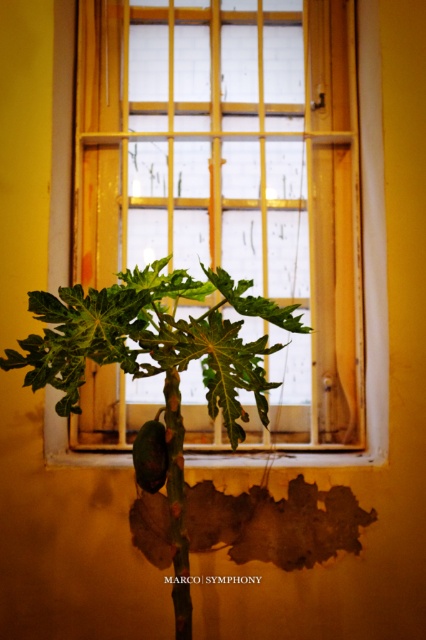
Can you confirm if green matte leafy plant at center is positioned to the right of wooden frame at center?

No, green matte leafy plant at center is not to the right of wooden frame at center.

Is green matte leafy plant at center thinner than wooden frame at center?

Yes.

Is point (192, 333) farther from camera compared to point (49, 188)?

No, it is not.

You are a GUI agent. You are given a task and a screenshot of the screen. Output one action in this format:
    pyautogui.click(x=<x>, y=<y>)
    Task: Click on the green matte leafy plant at center
    The height and width of the screenshot is (640, 426).
    Given the screenshot: What is the action you would take?
    pyautogui.click(x=155, y=340)